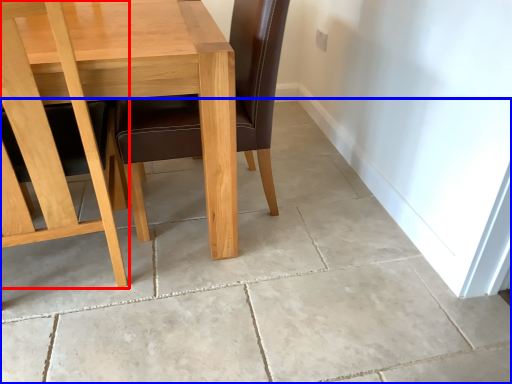
Question: Which point is closer to the camera, chair (highlighted by a red box) or concrete (highlighted by a blue box)?

Choices:
 (A) chair
 (B) concrete

Answer: (A)